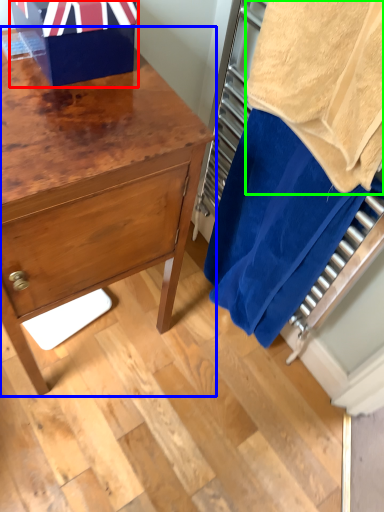
Question: Estimate the real-world distances between objects in this image. Which object is farther from gift box (highlighted by a red box), chest of drawers (highlighted by a blue box) or bath towel (highlighted by a green box)?

Choices:
 (A) chest of drawers
 (B) bath towel

Answer: (B)